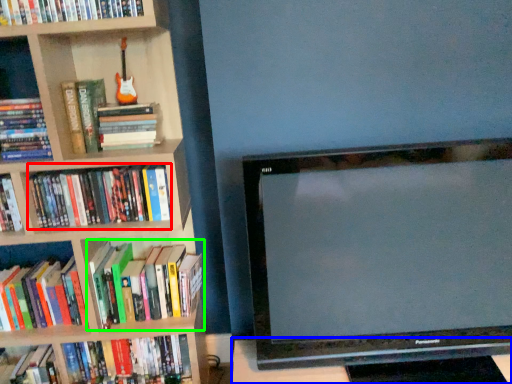
Question: Which is farther away from book (highlighted by a red box)? table (highlighted by a blue box) or book (highlighted by a green box)?

Choices:
 (A) table
 (B) book

Answer: (A)